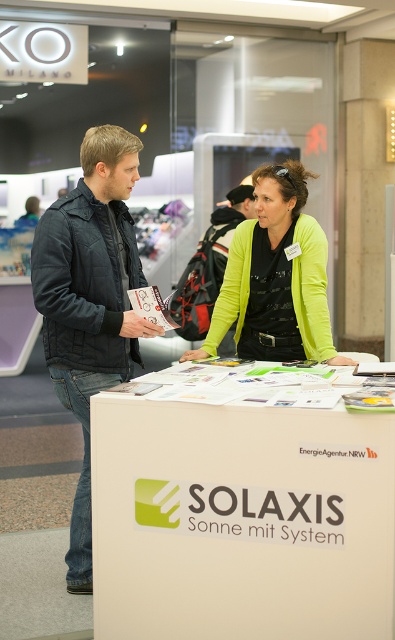
Is white cardboard sign at center wider than matte black jacket at left?

Yes, white cardboard sign at center is wider than matte black jacket at left.

Which is in front, point (338, 554) or point (45, 310)?

Point (338, 554) is in front.

Identify the location of white cardboard sign at center. (240, 506).

Is dark blue quilted jacket at left further to the viewer compared to lime green sweater at center?

No, it is in front of lime green sweater at center.

In the scene shown: Does dark blue quilted jacket at left come in front of lime green sweater at center?

Yes.

Does point (146, 330) come farther from viewer compared to point (267, 236)?

No, it is in front of (267, 236).

Identify the location of dark blue quilted jacket at left. (90, 301).

Does point (278, 328) come farther from viewer compared to point (94, 177)?

Yes, point (278, 328) is farther from viewer.

Who is shorter, lime green sweater at center or matte black jacket at left?

With less height is lime green sweater at center.

Which is in front, point (302, 298) or point (69, 182)?

Point (302, 298)

In order to click on lime green sweater at center in this screenshot , I will do `click(276, 276)`.